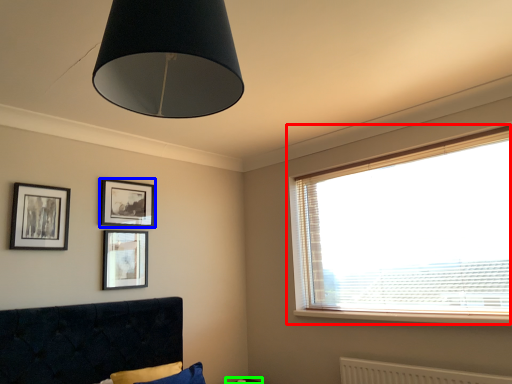
Question: Which is nearer to the window (highlighted by a red box)? picture frame (highlighted by a blue box) or table (highlighted by a green box).

Choices:
 (A) picture frame
 (B) table

Answer: (B)